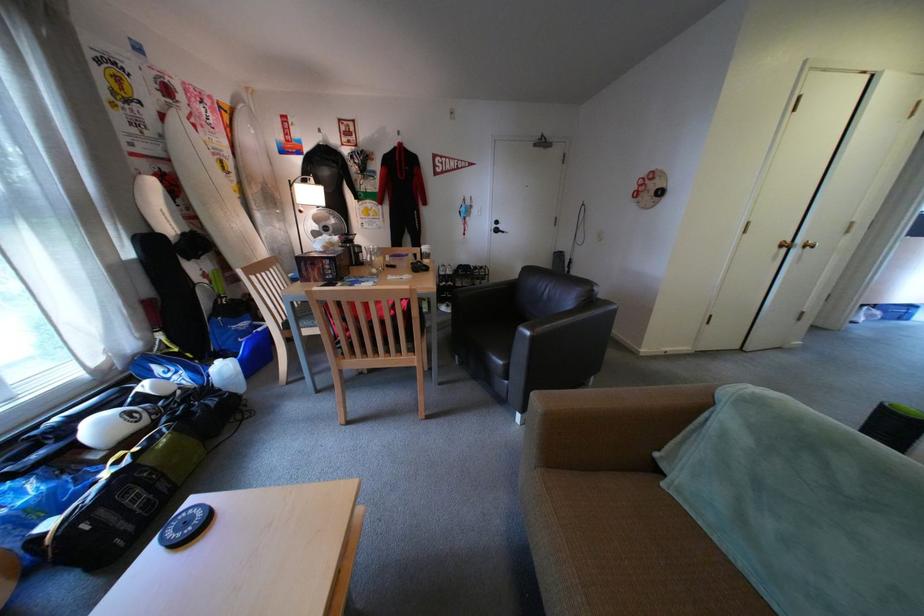
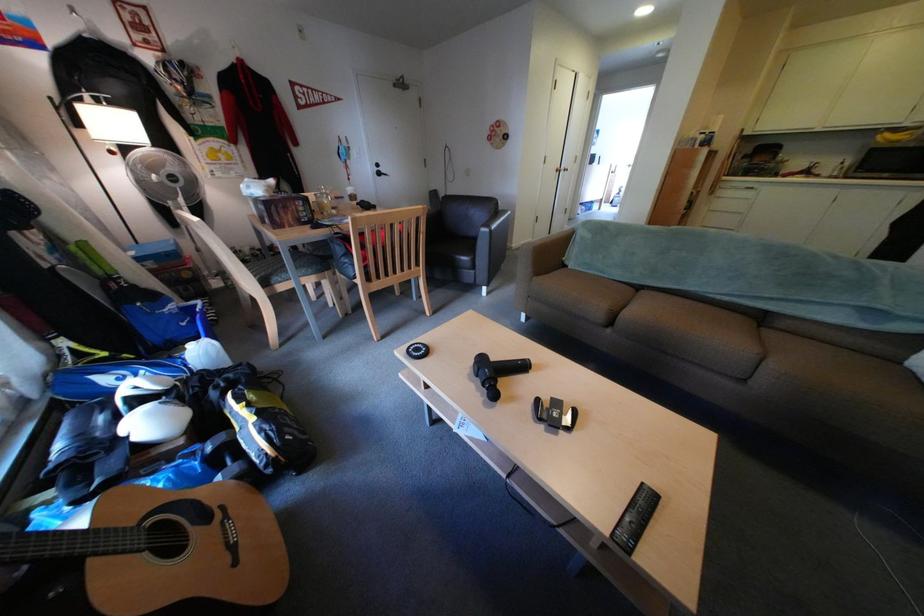
Find the pixel in the second image that matches point 233,363 in the first image.

(204, 347)